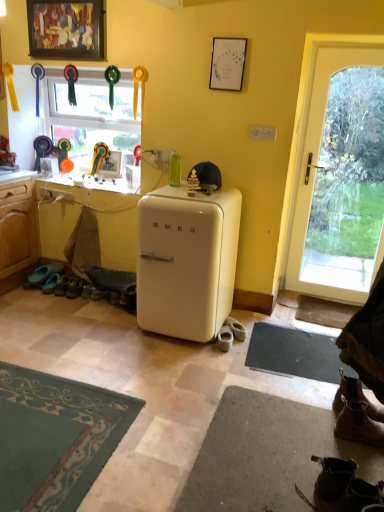
Question: In the image, is black rubber yoga mat at lower right on the left side or the right side of brown leather boot at lower right, the first footwear positioned from the right?

Choices:
 (A) right
 (B) left

Answer: (B)

Question: In the image, is black rubber yoga mat at lower right positioned in front of or behind brown leather boot at lower right, the first footwear positioned from the right?

Choices:
 (A) front
 (B) behind

Answer: (B)

Question: Which object is positioned closest to the brown leather boot at lower right, which is counted as the second footwear, starting from the right?

Choices:
 (A) white leather shoe at lower center, marked as the fourth footwear in a right-to-left arrangement
 (B) white glossy refrigerator at center
 (C) clear glass window at upper left
 (D) matte green shoe at lower left, the first footwear in the left-to-right sequence
 (E) brown leather boot at lower right, which is the fourth footwear in back-to-front order

Answer: (E)

Question: Based on their relative distances, which object is farther from the brown leather boot at lower right, which is the fourth footwear in back-to-front order?

Choices:
 (A) white leather shoe at lower center, marked as the fourth footwear in a right-to-left arrangement
 (B) matte green shoe at lower left, placed as the 5th footwear when sorted from right to left
 (C) clear glass window at upper left
 (D) white glass door at right
 (E) white glossy refrigerator at center

Answer: (C)